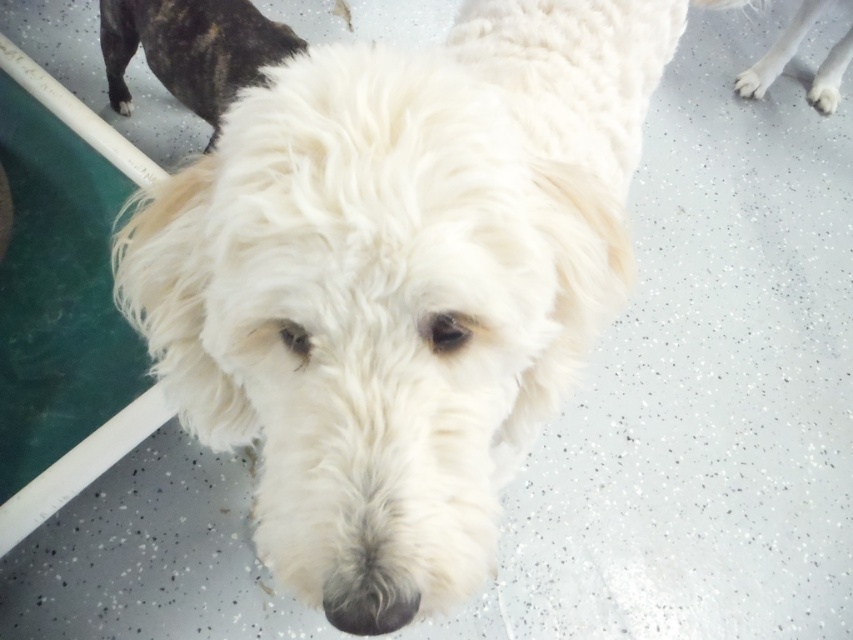
Question: Is black speckled fur at upper left thinner than white fluffy dog at upper right?

Choices:
 (A) no
 (B) yes

Answer: (A)

Question: Which of the following is the farthest from the observer?

Choices:
 (A) (807, 4)
 (B) (119, 58)

Answer: (A)

Question: Does black speckled fur at upper left lie behind white fluffy dog at upper right?

Choices:
 (A) yes
 (B) no

Answer: (B)

Question: Does black speckled fur at upper left have a lesser width compared to white fluffy dog at upper right?

Choices:
 (A) yes
 (B) no

Answer: (B)

Question: Which point is farther from the camera taking this photo?

Choices:
 (A) (833, 52)
 (B) (262, 42)

Answer: (A)

Question: Which object is farther from the camera taking this photo?

Choices:
 (A) black speckled fur at upper left
 (B) white fluffy dog at upper right

Answer: (B)